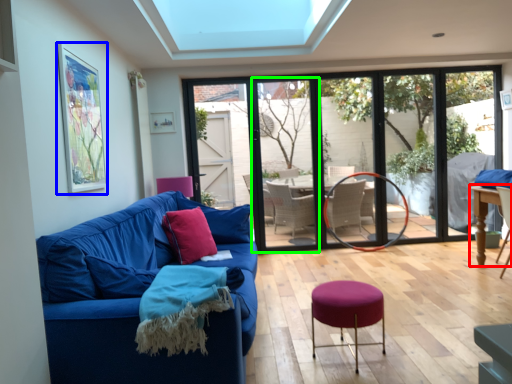
Question: Based on their relative distances, which object is nearer to table (highlighted by a red box)? Choose from picture frame (highlighted by a blue box) and screen door (highlighted by a green box).

Choices:
 (A) picture frame
 (B) screen door

Answer: (B)